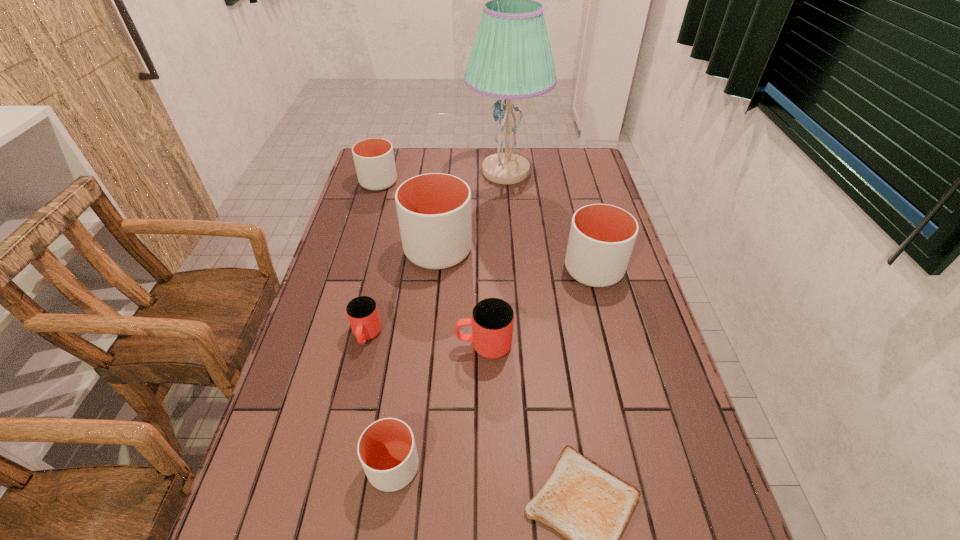
This screenshot has width=960, height=540. In order to click on white cup that is the second closest to the toast in this screenshot , I will do `click(602, 237)`.

Where is `free space that satisfies the following two spatial constraints: 1. on the back side of the tallest object; 2. on the right side of the smallest white cup`? The height and width of the screenshot is (540, 960). free space that satisfies the following two spatial constraints: 1. on the back side of the tallest object; 2. on the right side of the smallest white cup is located at coordinates pos(434,172).

The height and width of the screenshot is (540, 960). In order to click on free space that satisfies the following two spatial constraints: 1. on the handle side of the right pink cup; 2. on the handle side of the left pink cup in this screenshot , I will do `click(484, 335)`.

The image size is (960, 540). I want to click on vacant region that satisfies the following two spatial constraints: 1. on the handle side of the bigger pink cup; 2. on the right side of the rightmost cup, so click(483, 269).